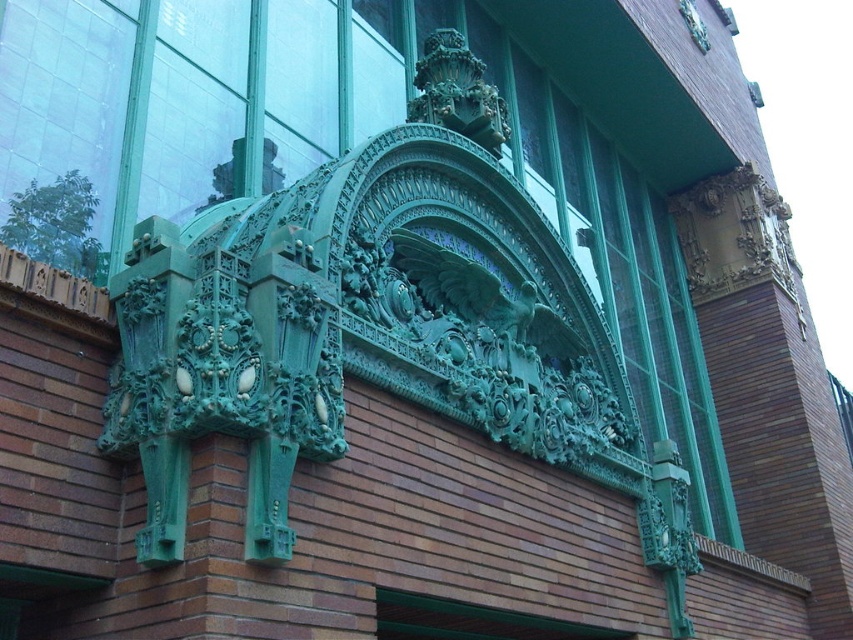
Does green patina eagle at center appear on the left side of green patina ornament at center?

Incorrect, green patina eagle at center is not on the left side of green patina ornament at center.

Which is more to the right, green patina eagle at center or green patina ornament at center?

Positioned to the right is green patina eagle at center.

What do you see at coordinates (483, 298) in the screenshot? This screenshot has width=853, height=640. I see `green patina eagle at center` at bounding box center [483, 298].

This screenshot has width=853, height=640. I want to click on green patina eagle at center, so click(483, 298).